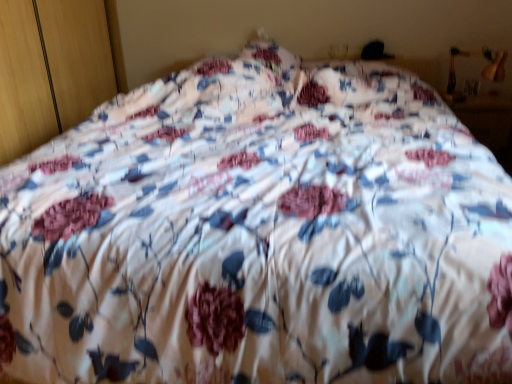
Locate an element on the screen. wooden table lamp at upper right is located at coordinates point(481,72).

The width and height of the screenshot is (512, 384). Describe the element at coordinates (481, 72) in the screenshot. I see `wooden table lamp at upper right` at that location.

Find the location of a particular element. wooden table lamp at upper right is located at coordinates (481, 72).